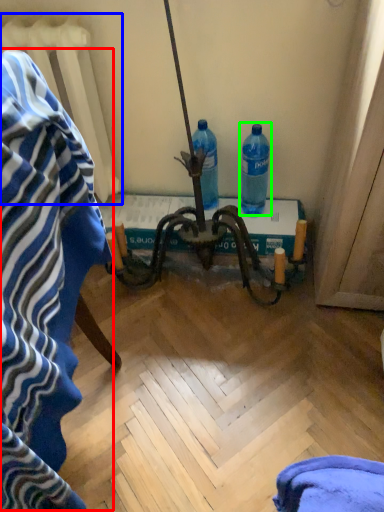
Question: Which object is the farthest from bath towel (highlighted by a red box)? Choose among these: radiator (highlighted by a blue box) or bottle (highlighted by a green box).

Choices:
 (A) radiator
 (B) bottle

Answer: (B)